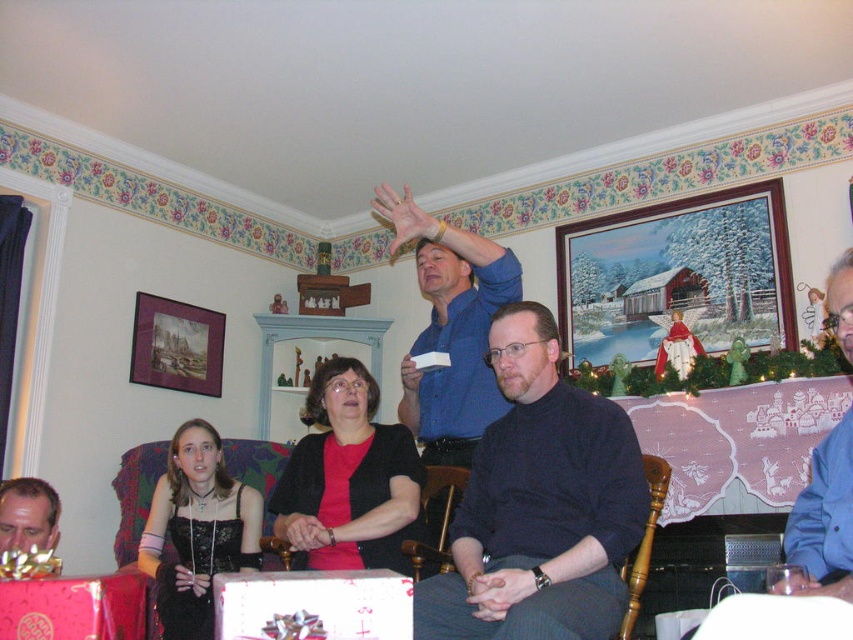
Question: Which of the following is the closest to the observer?

Choices:
 (A) black matte shirt at center
 (B) blue shirt at center
 (C) blue shirt at upper right
 (D) matte black hair at lower left

Answer: (C)

Question: Which object is the farthest from the blue shirt at upper right?

Choices:
 (A) black matte shirt at center
 (B) blue shirt at center

Answer: (B)

Question: Is black matte shirt at center further to camera compared to blue shirt at upper right?

Choices:
 (A) no
 (B) yes

Answer: (B)

Question: Is black matte shirt at center in front of blue shirt at center?

Choices:
 (A) yes
 (B) no

Answer: (A)

Question: Does blue shirt at center have a greater width compared to blue shirt at upper right?

Choices:
 (A) yes
 (B) no

Answer: (A)

Question: Which object is positioned closest to the black matte shirt at center?

Choices:
 (A) matte black hair at lower left
 (B) blue shirt at center
 (C) blue shirt at upper right

Answer: (C)